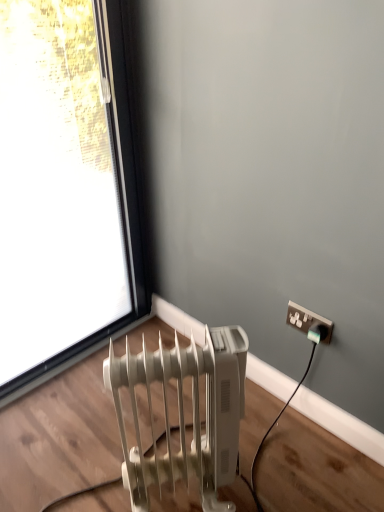
Question: Should I look upward or downward to see white plastic radiator at lower left?

Choices:
 (A) up
 (B) down

Answer: (B)

Question: Is white plastic radiator at lower left bigger than white plastic power plugs and sockets at upper right?

Choices:
 (A) yes
 (B) no

Answer: (A)

Question: Does white plastic radiator at lower left have a greater width compared to white plastic power plugs and sockets at upper right?

Choices:
 (A) yes
 (B) no

Answer: (A)

Question: Is the depth of white plastic radiator at lower left greater than that of white plastic power plugs and sockets at upper right?

Choices:
 (A) yes
 (B) no

Answer: (B)

Question: Can you confirm if white plastic radiator at lower left is thinner than white plastic power plugs and sockets at upper right?

Choices:
 (A) yes
 (B) no

Answer: (B)

Question: Is white plastic radiator at lower left beside white plastic power plugs and sockets at upper right?

Choices:
 (A) no
 (B) yes

Answer: (A)

Question: Considering the relative positions of white plastic radiator at lower left and white plastic power plugs and sockets at upper right in the image provided, is white plastic radiator at lower left to the left of white plastic power plugs and sockets at upper right from the viewer's perspective?

Choices:
 (A) no
 (B) yes

Answer: (B)

Question: From the image's perspective, is transparent glass window at upper left located beneath white plastic power plugs and sockets at upper right?

Choices:
 (A) yes
 (B) no

Answer: (B)

Question: Does transparent glass window at upper left have a larger size compared to white plastic power plugs and sockets at upper right?

Choices:
 (A) no
 (B) yes

Answer: (B)

Question: Is transparent glass window at upper left facing away from white plastic power plugs and sockets at upper right?

Choices:
 (A) no
 (B) yes

Answer: (A)

Question: Does transparent glass window at upper left have a greater width compared to white plastic power plugs and sockets at upper right?

Choices:
 (A) yes
 (B) no

Answer: (A)

Question: Considering the relative positions of transparent glass window at upper left and white plastic power plugs and sockets at upper right in the image provided, is transparent glass window at upper left in front of white plastic power plugs and sockets at upper right?

Choices:
 (A) no
 (B) yes

Answer: (B)

Question: Is transparent glass window at upper left to the right of white plastic power plugs and sockets at upper right from the viewer's perspective?

Choices:
 (A) no
 (B) yes

Answer: (A)

Question: Is white plastic radiator at lower left bigger than transparent glass window at upper left?

Choices:
 (A) no
 (B) yes

Answer: (A)